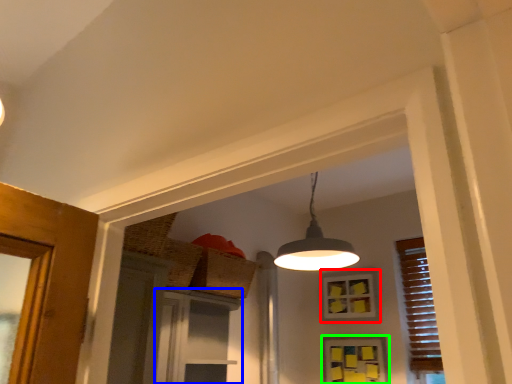
Question: Based on their relative distances, which object is nearer to window (highlighted by a red box)? Choose from screen door (highlighted by a blue box) and window (highlighted by a green box).

Choices:
 (A) screen door
 (B) window

Answer: (B)